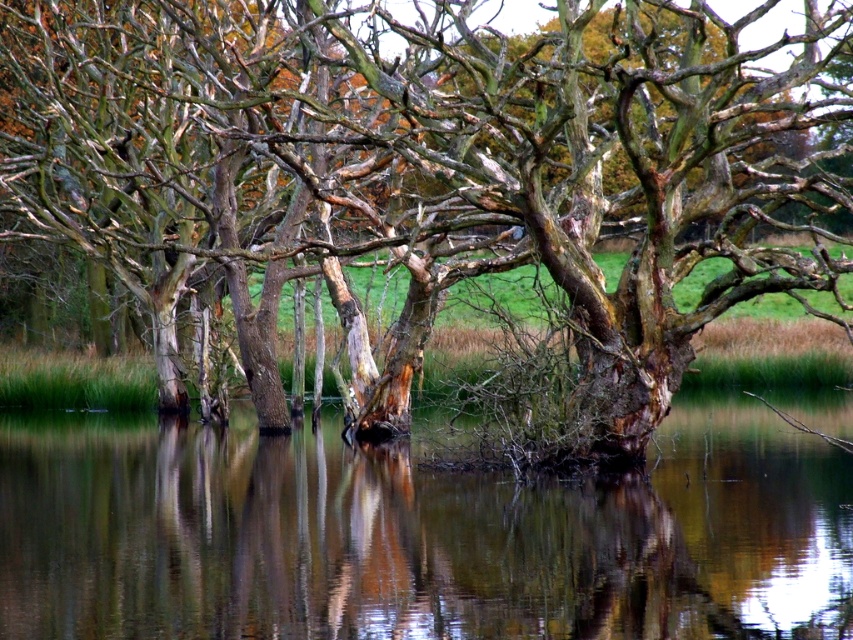
Question: In this image, where is transparent water at center located relative to brown wood at center?

Choices:
 (A) left
 (B) right

Answer: (B)

Question: Which point is closer to the camera?

Choices:
 (A) (381, 168)
 (B) (724, 452)
 (C) (360, 621)

Answer: (C)

Question: Is transparent water at center closer to the viewer compared to brown wood at center?

Choices:
 (A) yes
 (B) no

Answer: (A)

Question: Which point is closer to the camera?

Choices:
 (A) smooth bark tree at center
 (B) transparent water at center

Answer: (B)

Question: Which point is closer to the camera?

Choices:
 (A) transparent water at center
 (B) smooth bark tree at center
 (C) brown wood at center

Answer: (A)

Question: Does smooth bark tree at center appear under transparent water at center?

Choices:
 (A) yes
 (B) no

Answer: (B)